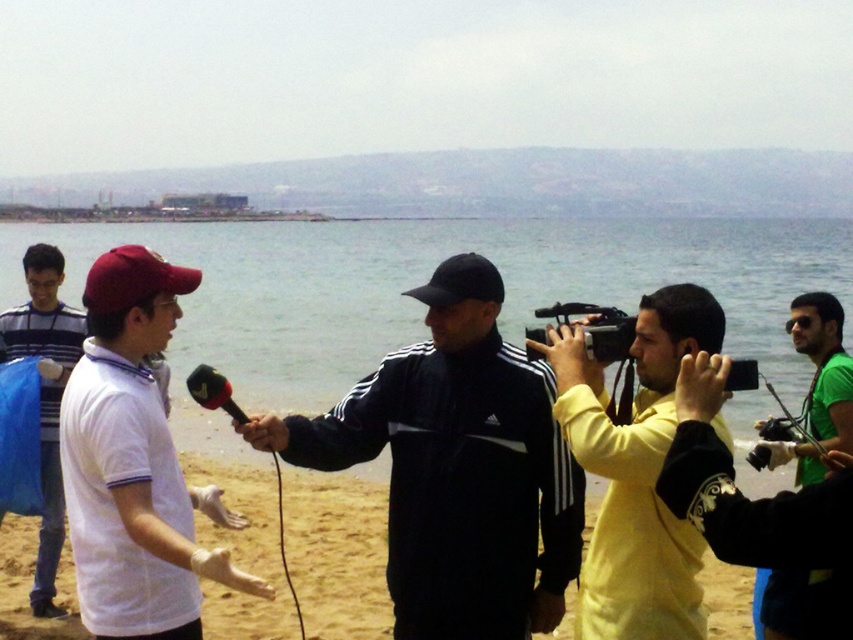
You are a photographer at the beach scene. You need to capture a photo that includes both the white matte shirt at center and the black plastic video camera at center. Considering their sizes, which object will appear larger in your photo?

The white matte shirt at center is much taller than the black plastic video camera at center, so it will appear larger in the photo.

You are a drone operator trying to capture a birdseye view of the beach scene. The drone is currently at a position above the black plastic video camera at center. To ensure the entire beach scene is visible in the frame, should you move the drone higher or lower?

Since the drone is positioned above the black plastic video camera at center, which is located at coordinates point (596, 328), moving the drone higher would allow for a broader view, ensuring the entire beach scene is captured in the frame.

You are standing at the beach and want to take a photo of both the person with the microphone and the camera operator. The person with the microphone is at point (625, 358) and the camera operator is at point (228, 401). Which point is closer to you so that you can focus on them first?

Point (228, 401) is closer to you than point (625, 358), so you should focus on the camera operator at point (228, 401) first.